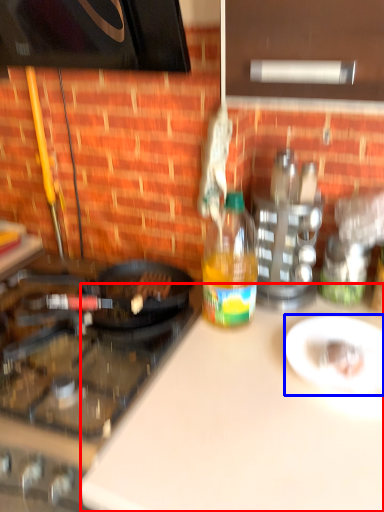
Question: Which of the following is the farthest to the observer, counter top (highlighted by a red box) or plate (highlighted by a blue box)?

Choices:
 (A) counter top
 (B) plate

Answer: (B)